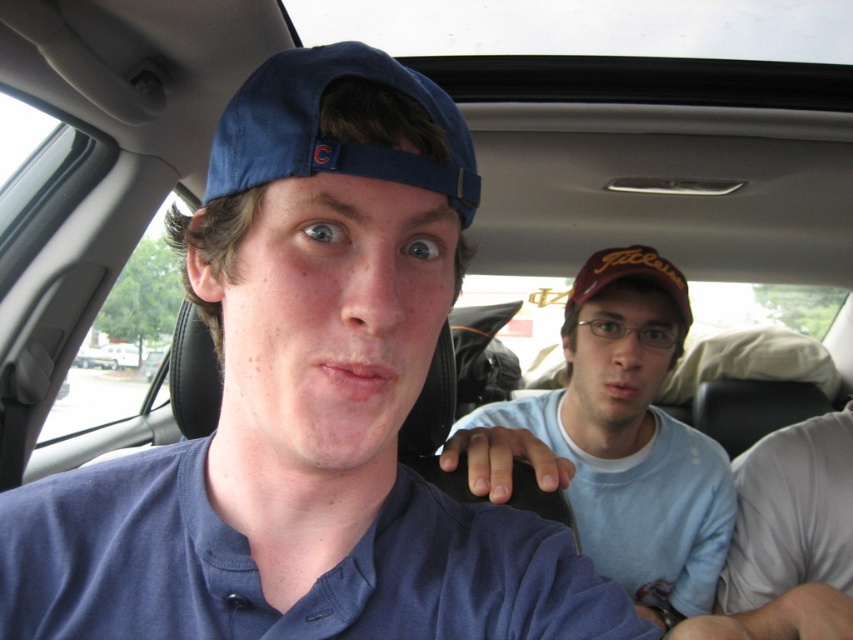
Is light blue cotton shirt at center further to camera compared to brown matte cap at center?

No.

Who is taller, light blue cotton shirt at center or brown matte cap at center?

With more height is light blue cotton shirt at center.

Describe the element at coordinates (618, 440) in the screenshot. The width and height of the screenshot is (853, 640). I see `light blue cotton shirt at center` at that location.

Where is `light blue cotton shirt at center`? light blue cotton shirt at center is located at coordinates (618, 440).

Is the position of light blue cotton shirt at center less distant than that of blue fabric cap at upper center?

No, light blue cotton shirt at center is behind blue fabric cap at upper center.

Who is more forward, (637, 500) or (457, 198)?

Point (457, 198) is in front.

Measure the distance between light blue cotton shirt at center and camera.

They are 1.21 meters apart.

Where is `light blue cotton shirt at center`? light blue cotton shirt at center is located at coordinates (618, 440).

Is blue fabric cap at upper center below brown matte cap at center?

No, blue fabric cap at upper center is not below brown matte cap at center.

Which is in front, point (383, 172) or point (635, 260)?

Positioned in front is point (383, 172).

What do you see at coordinates (329, 140) in the screenshot?
I see `blue fabric cap at upper center` at bounding box center [329, 140].

Where is `blue fabric cap at upper center`? The image size is (853, 640). blue fabric cap at upper center is located at coordinates (x=329, y=140).